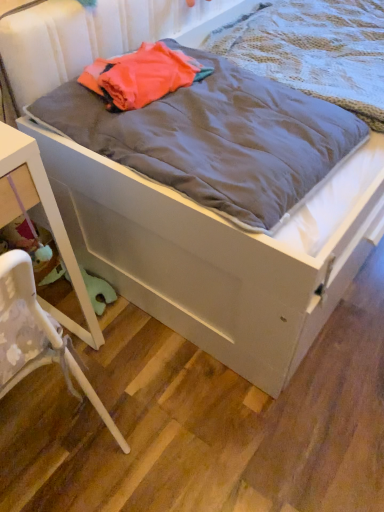
Locate an element on the screen. free region under white plastic chair at lower left (from a real-world perspective) is located at coordinates (57, 454).